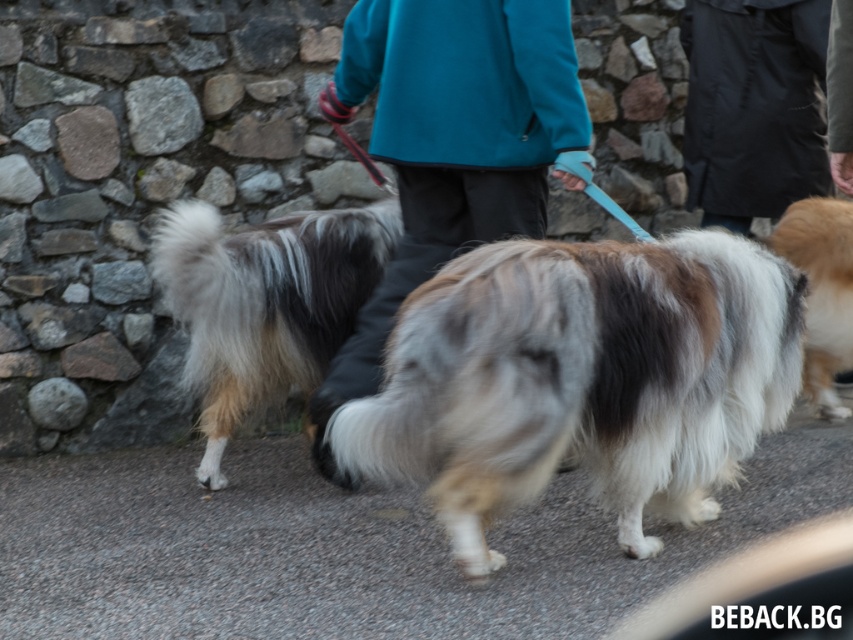
You are a photographer standing in the scene and want to take a photo of the black waterproof jacket at upper right and the fluffy beige dog at right. Which object should you focus on first to ensure it appears sharp in the photo?

The black waterproof jacket at upper right is closer to you than the fluffy beige dog at right, so you should focus on the black waterproof jacket at upper right first to ensure it appears sharp.

You are a photographer standing at the edge of the paved road. You want to take a photo that includes both the teal fleece jacket at center and the black waterproof jacket at upper right. Which jacket should you focus on first to ensure both are in frame?

The teal fleece jacket at center is positioned under the black waterproof jacket at upper right, so focusing on the black waterproof jacket at upper right first will ensure both are in frame.